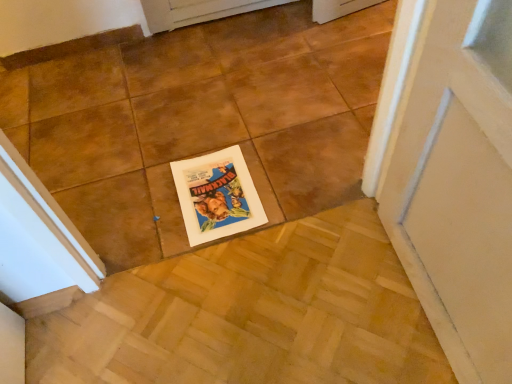
Where is `free point above white paper comic book at center (from a real-world perspective)`? free point above white paper comic book at center (from a real-world perspective) is located at coordinates (212, 185).